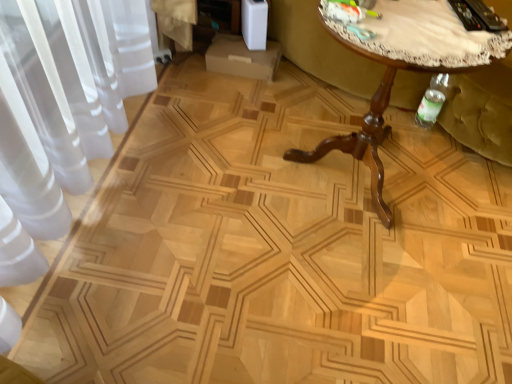
The image size is (512, 384). I want to click on free space in front of brown wooden table at center, so click(x=371, y=288).